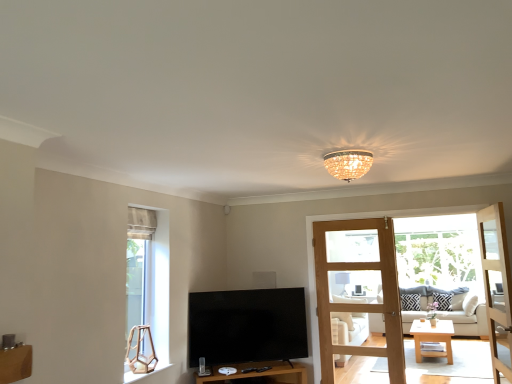
Question: Would you say white wood coffee table at center is to the left or to the right of white fabric studio couch at center in the picture?

Choices:
 (A) left
 (B) right

Answer: (A)

Question: Looking at the image, does white wood coffee table at center seem bigger or smaller compared to white fabric studio couch at center?

Choices:
 (A) small
 (B) big

Answer: (A)

Question: Considering the real-world distances, which object is farthest from the white sheer curtain at upper left?

Choices:
 (A) light brown wooden door at right, the 2th door when ordered from left to right
 (B) light wood entertainment center at right
 (C) wooden at center
 (D) black and white zigzag pillow at center, placed as the 2th pillow when sorted from left to right
 (E) black glossy tv at center

Answer: (D)

Question: Which object is positioned closest to the matte black speaker at center?

Choices:
 (A) light brown wooden door at center, which ranks as the 2th door in right-to-left order
 (B) wooden at center
 (C) black glossy tv at center
 (D) white fabric studio couch at center
 (E) black and white zigzag pillow at center, placed as the 2th pillow when sorted from left to right

Answer: (C)